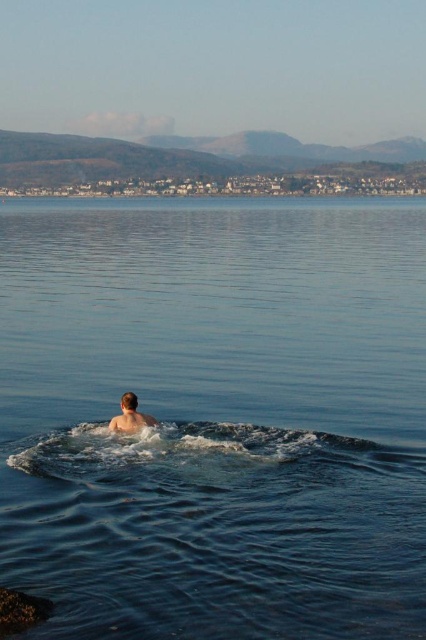
Is point (417, 372) more distant than point (127, 401)?

Yes, it is behind point (127, 401).

Does clear blue water at center have a lesser width compared to light brown skin at center?

No.

From the picture: Who is more forward, (386,336) or (135,410)?

Point (135,410) is more forward.

The width and height of the screenshot is (426, 640). I want to click on clear blue water at center, so [215, 417].